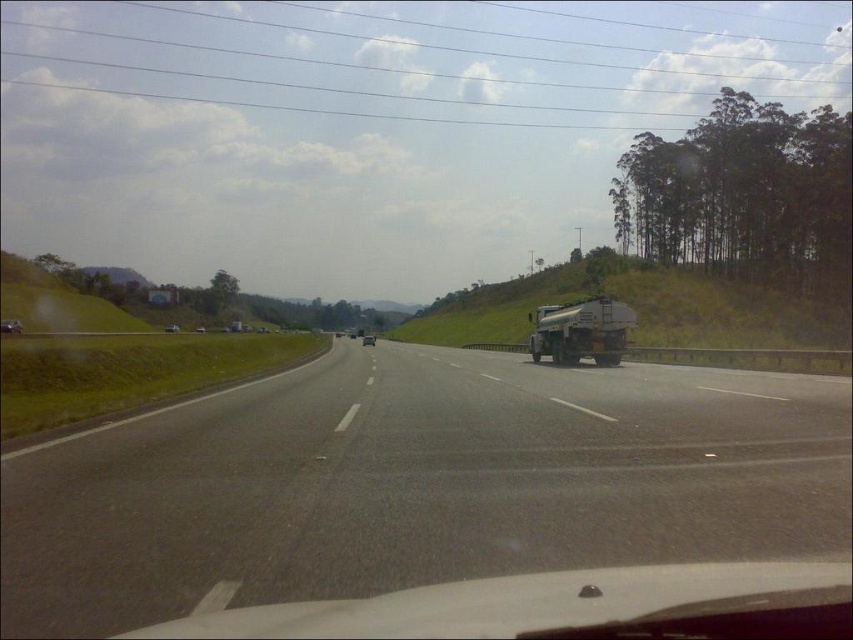
You are driving a car and need to make an emergency stop. You see the black asphalt highway at center and the metallic silver tanker at right. Which object is closer to you as you apply the brakes?

The black asphalt highway at center is closer to the viewer than the metallic silver tanker at right, so the highway will be the first thing you encounter as you apply the brakes.

You are driving a car and see the metallic silver tanker at right and the shiny silver sedan at center. Which vehicle is nearer to you?

The metallic silver tanker at right is closer to the viewer than the shiny silver sedan at center.